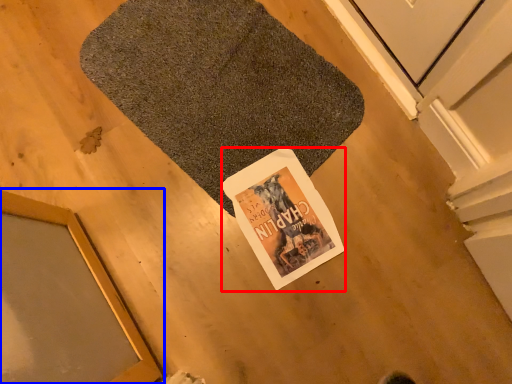
Question: Which object appears farthest to the camera in this image, magazine (highlighted by a red box) or window (highlighted by a blue box)?

Choices:
 (A) magazine
 (B) window

Answer: (A)